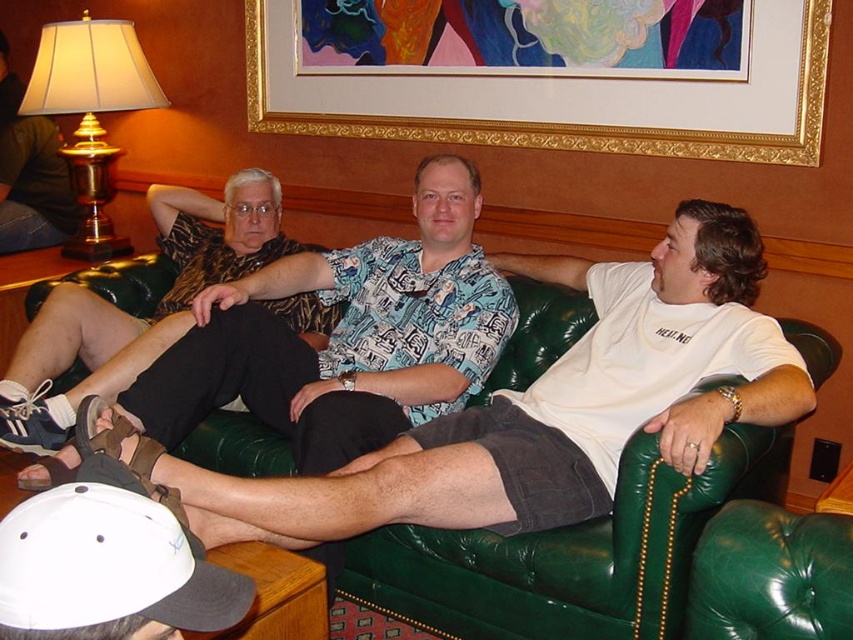
Is green leather couch at center smaller than printed fabric shirt at center?

Indeed, green leather couch at center has a smaller size compared to printed fabric shirt at center.

Does green leather couch at center appear on the right side of printed fabric shirt at center?

Yes, green leather couch at center is to the right of printed fabric shirt at center.

The image size is (853, 640). What are the coordinates of `green leather couch at center` in the screenshot? It's located at (569, 554).

Identify the location of green leather couch at center. This screenshot has width=853, height=640. (569, 554).

Describe the element at coordinates (556, 97) in the screenshot. This screenshot has height=640, width=853. I see `gold-framed picture at upper center` at that location.

Between gold-framed picture at upper center and gold metallic lampshade at upper left, which one has less height?

gold-framed picture at upper center

The image size is (853, 640). Find the location of `gold-framed picture at upper center`. gold-framed picture at upper center is located at coordinates (556, 97).

What are the coordinates of `printed fabric shirt at center` in the screenshot? It's located at (344, 337).

Consider the image. How far apart are printed fabric shirt at center and white matte baseball cap at lower left?

printed fabric shirt at center is 1.18 meters away from white matte baseball cap at lower left.

Between point (231, 346) and point (151, 616), which one is positioned in front?

Point (151, 616)

The width and height of the screenshot is (853, 640). Find the location of `printed fabric shirt at center`. printed fabric shirt at center is located at coordinates (344, 337).